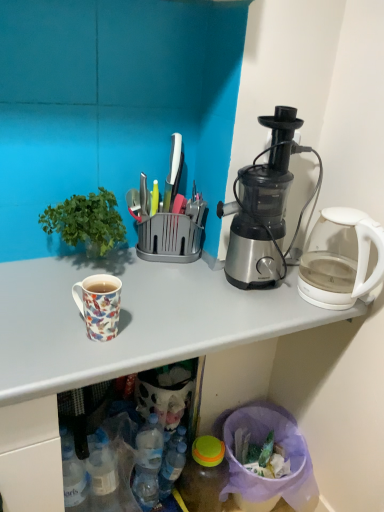
Identify the location of vacant region in front of floral ceramic mug at left. Image resolution: width=384 pixels, height=512 pixels. (74, 362).